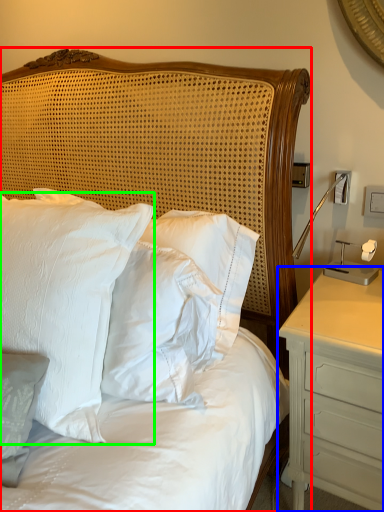
Question: Which object is positioned farthest from bed (highlighted by a red box)? Select from nightstand (highlighted by a blue box) and pillow (highlighted by a green box).

Choices:
 (A) nightstand
 (B) pillow

Answer: (A)